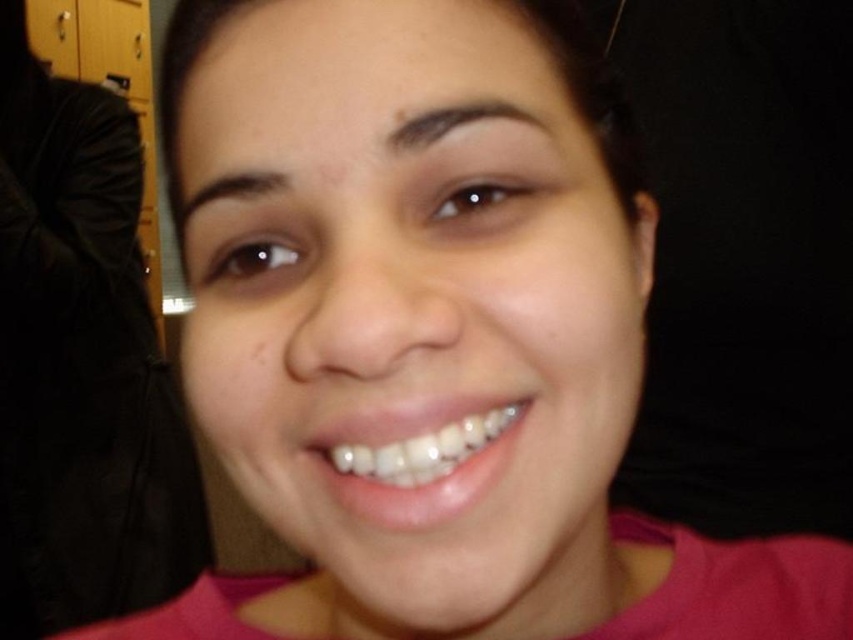
You are an AI analyzing clothing placement in images. In the scene described, where is the pink matte shirt at center located in terms of coordinates?

The pink matte shirt at center is located at coordinates point (x=80, y=365).

You are a photographer adjusting your camera to focus on the pink matte shirt at center and the white glossy teeth at center. Which object should you adjust your focus to first if you want to capture both in the same frame without moving the camera?

You should focus on the pink matte shirt at center first because it is positioned to the left of the white glossy teeth at center, so adjusting focus on the shirt first allows the camera to capture both objects in the frame without needing to reposition.